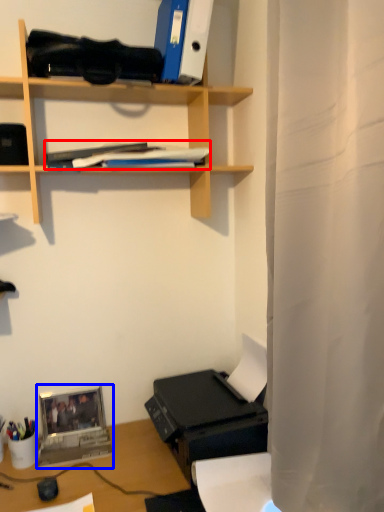
Question: Which of the following is the farthest to the observer, book (highlighted by a red box) or laptop (highlighted by a blue box)?

Choices:
 (A) book
 (B) laptop

Answer: (B)